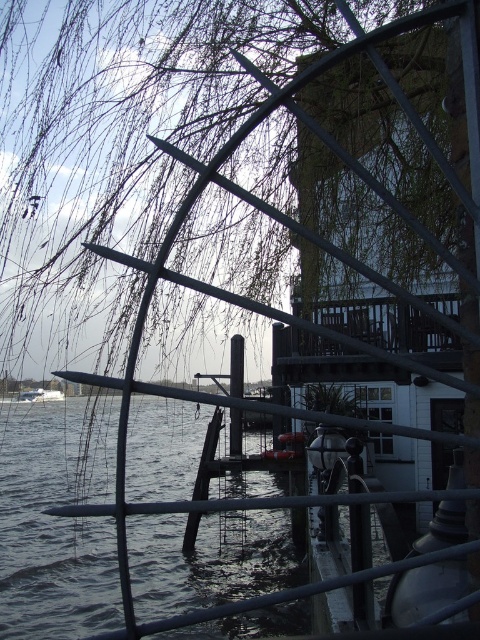
You are standing at the center of the image and want to locate the green leafy tree at upper left. In which direction should you look to find it?

The green leafy tree at upper left is located at point 0.216 on the x axis and 0.244 on the y axis, so you should look to the upper left direction to find it.

You are an artist setting up your easel to paint the riverside scene. You want to include both the green leafy tree at upper left and the white glossy boat at lower left in your painting. Which object should you make larger in your artwork to accurately represent their sizes as seen in the image?

The green leafy tree at upper left should be made larger in the painting since it has a larger size compared to the white glossy boat at lower left as seen in the image.

Consider the image. You are standing at the riverside and want to take a photo of the green leafy tree at upper left. If your camera has a maximum zoom range of 5 meters, will you be able to capture the tree clearly without moving closer?

The green leafy tree at upper left is 6.65 meters away from the viewer. Since the camera can only zoom up to 5 meters, you won cannot capture the tree clearly without moving closer.